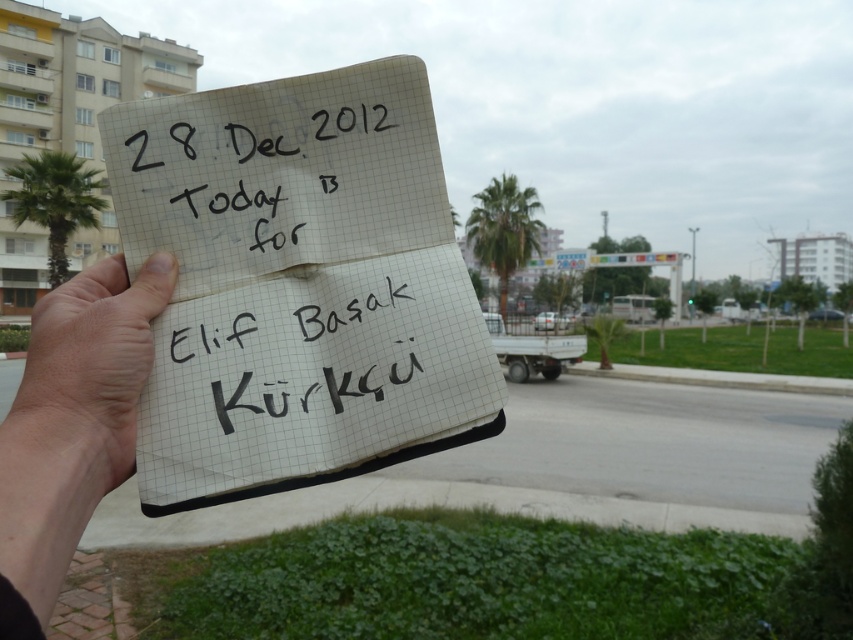
Does point (267, 216) come in front of point (341, 275)?

That is False.

Is white paper at center in front of black paper at center?

Yes, it is.

Does point (389, 429) lie in front of point (230, 337)?

Yes, it is.

This screenshot has width=853, height=640. Identify the location of white paper at center. (299, 284).

Who is taller, white paper at center or dry skin at center?

With more height is white paper at center.

Is white paper at center shorter than dry skin at center?

No.

The image size is (853, 640). I want to click on white paper at center, so click(299, 284).

Looking at this image, is green leafy palm tree at left below green leafy palm tree at upper center?

No.

Between green leafy palm tree at left and green leafy palm tree at upper center, which one is positioned lower?

Positioned lower is green leafy palm tree at upper center.

Image resolution: width=853 pixels, height=640 pixels. I want to click on green leafy palm tree at left, so click(x=54, y=202).